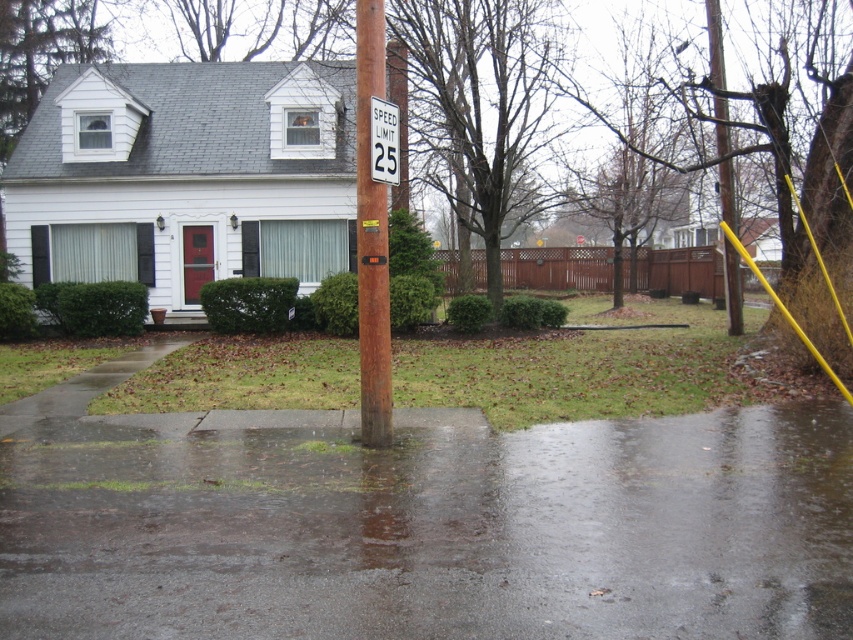
Which is above, bare wood tree at center or yellow painted wood at upper right?

bare wood tree at center

Does point (492, 42) come farther from viewer compared to point (721, 99)?

Yes, point (492, 42) is farther from viewer.

Locate an element on the screen. bare wood tree at center is located at coordinates (480, 108).

Who is lower down, rusty metal pole at center or yellow painted wood at upper right?

rusty metal pole at center

Is rusty metal pole at center below yellow painted wood at upper right?

Correct, rusty metal pole at center is located below yellow painted wood at upper right.

Measure the distance between rusty metal pole at center and camera.

rusty metal pole at center is 7.68 meters from camera.

You are a GUI agent. You are given a task and a screenshot of the screen. Output one action in this format:
    pyautogui.click(x=<x>, y=<y>)
    Task: Click on the rusty metal pole at center
    
    Given the screenshot: What is the action you would take?
    pyautogui.click(x=370, y=236)

Between rusty metal pole at center and white plastic speed limit sign at center, which one is positioned lower?

rusty metal pole at center is below.

Locate an element on the screen. The height and width of the screenshot is (640, 853). rusty metal pole at center is located at coordinates (370, 236).

Where is `rusty metal pole at center`? The width and height of the screenshot is (853, 640). rusty metal pole at center is located at coordinates (370, 236).